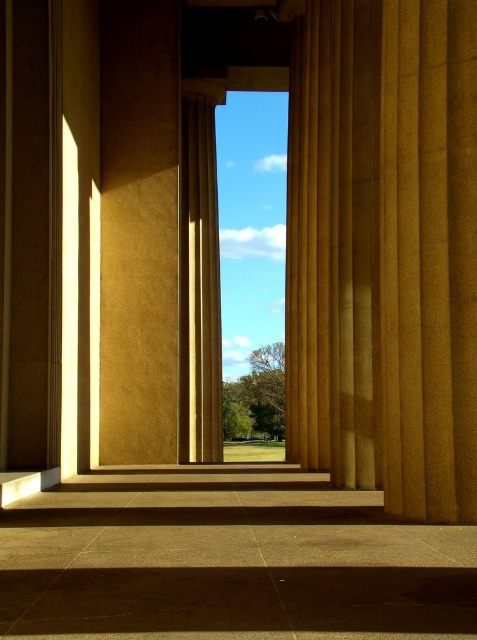
Who is positioned more to the right, golden stone pillar at center or matte gold column at center?

golden stone pillar at center

Who is shorter, golden stone pillar at center or matte gold column at center?

Standing shorter between the two is golden stone pillar at center.

Does point (395, 19) come in front of point (207, 324)?

Yes, it is in front of point (207, 324).

You are a GUI agent. You are given a task and a screenshot of the screen. Output one action in this format:
    pyautogui.click(x=<x>, y=<y>)
    Task: Click on the golden stone pillar at center
    This screenshot has height=640, width=477.
    Given the screenshot: What is the action you would take?
    pyautogui.click(x=395, y=250)